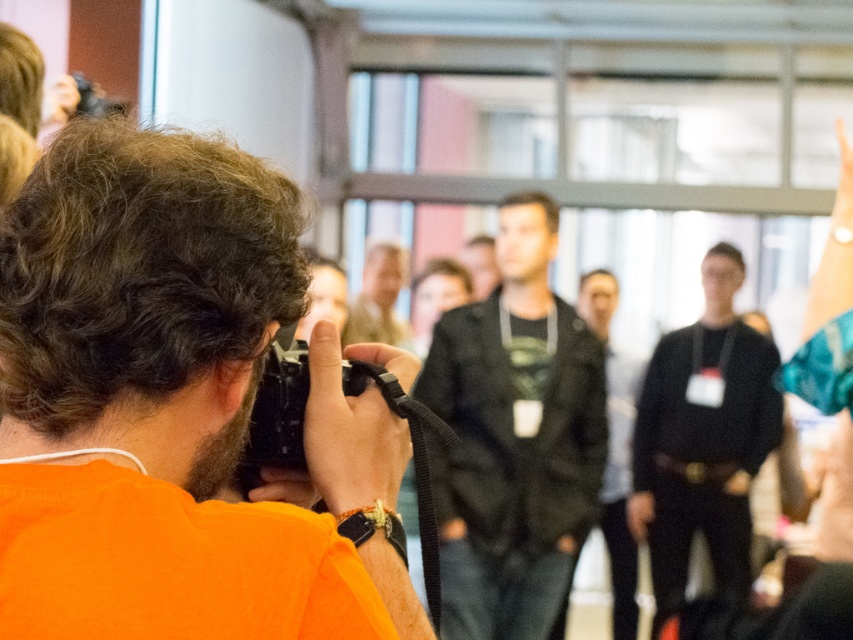
You are standing at the edge of a crowd and see the dark green jacket at center and the black plastic camera at center. If you want to reach both items without moving, which one is closer to you?

The dark green jacket at center is 4.98 meters from the black plastic camera at center. Since you are at the edge of the crowd, the black plastic camera at center is closer to you because it is only 4.98 meters away from the jacket, but the exact distance from you to each item isn

You are at an event and want to take a photo with your black plastic camera at center. There is a person wearing a black leather jacket at center in front of you. Can you move to the right to get a better angle? Explain why or why not based on their positions.

Result: The black leather jacket at center is to the right of the black plastic camera at center, so moving to the right would place you behind the jacket, blocking your view. Therefore, moving to the right is not advisable for a better angle.